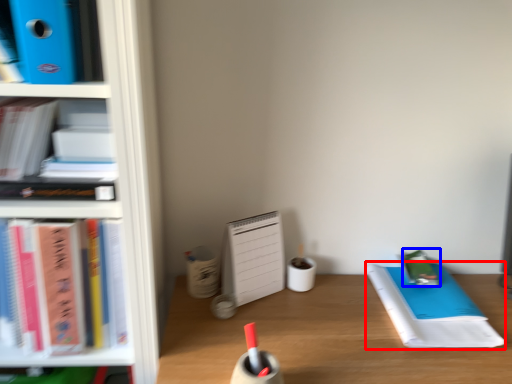
Question: Which point is further to the camera, notebook (highlighted by a red box) or stationery (highlighted by a blue box)?

Choices:
 (A) notebook
 (B) stationery

Answer: (B)